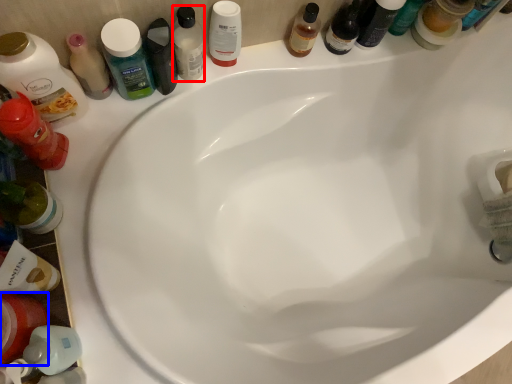
Question: Which object is further to the camera taking this photo, mouthwash (highlighted by a red box) or mouthwash (highlighted by a blue box)?

Choices:
 (A) mouthwash
 (B) mouthwash

Answer: (A)